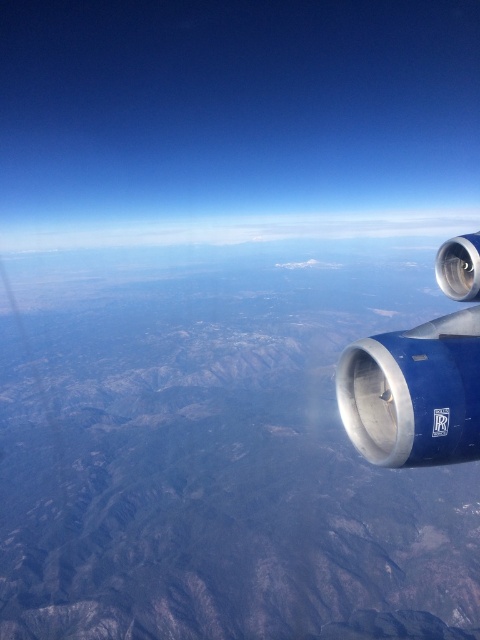
Identify the location of blue metallic engine at right. The image size is (480, 640). (414, 392).

You are a GUI agent. You are given a task and a screenshot of the screen. Output one action in this format:
    pyautogui.click(x=<x>, y=<y>)
    Task: Click on the blue metallic engine at right
    This screenshot has height=640, width=480.
    Given the screenshot: What is the action you would take?
    pyautogui.click(x=414, y=392)